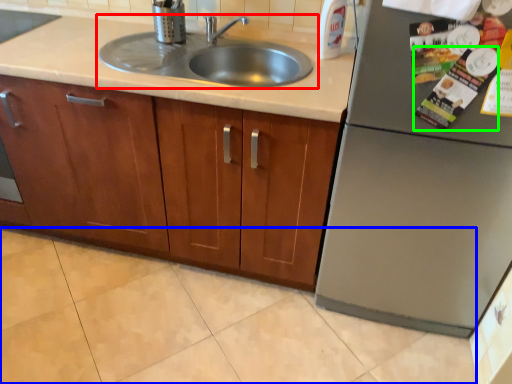
Question: Considering the real-world distances, which object is closest to sink (highlighted by a red box)? granite (highlighted by a blue box) or magazine (highlighted by a green box).

Choices:
 (A) granite
 (B) magazine

Answer: (B)